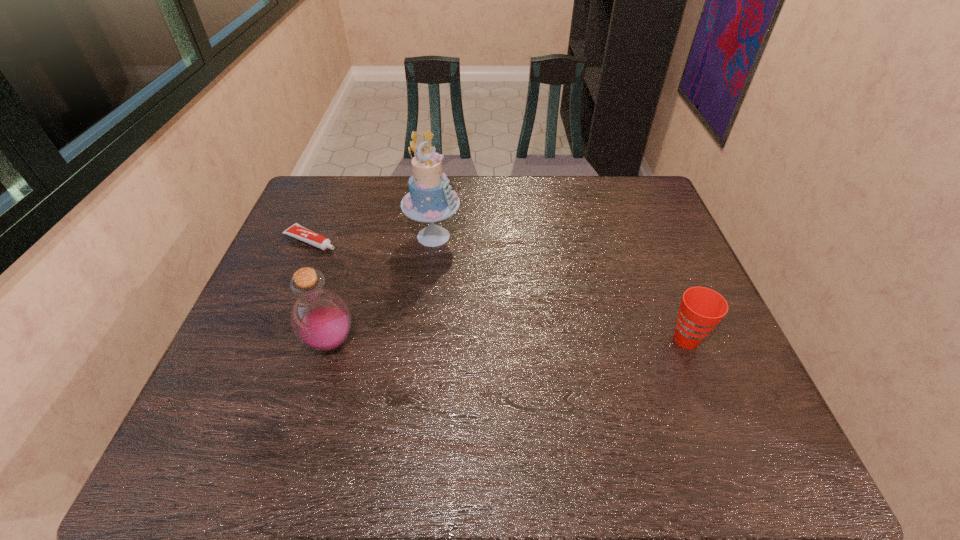
At what (x,y) coordinates should I click in order to perform the action: click on vacant position in the image that satisfies the following two spatial constraints: 1. on the back side of the bottle; 2. on the right side of the third object from left to right. Please return your answer as a coordinate pair (x, y). Image resolution: width=960 pixels, height=540 pixels. Looking at the image, I should click on (361, 237).

The image size is (960, 540). Find the location of `vacant space that satisfies the following two spatial constraints: 1. on the front side of the third tallest object; 2. on the right side of the toothpaste`. vacant space that satisfies the following two spatial constraints: 1. on the front side of the third tallest object; 2. on the right side of the toothpaste is located at coordinates (270, 340).